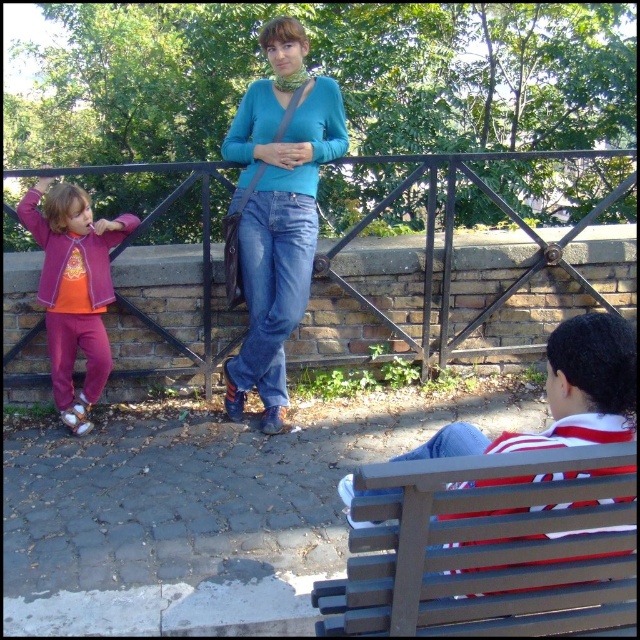
You are a park visitor trying to sit down. You see the brown wooden bench at lower right and the striped cotton shirt at lower right. Which object is wider?

The brown wooden bench at lower right is wider than the striped cotton shirt at lower right.